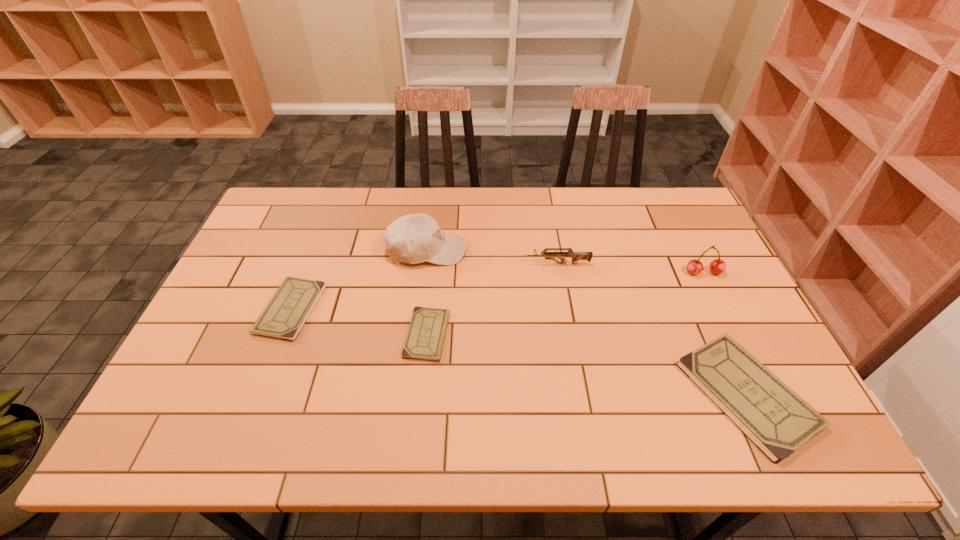
At what (x,y) coordinates should I click in order to perform the action: click on checkbook at the right edge. Please return your answer as a coordinate pair (x, y). The image size is (960, 540). Looking at the image, I should click on (778, 421).

Where is `cherry at the right edge`? This screenshot has width=960, height=540. cherry at the right edge is located at coordinates (717, 266).

Identify the location of object at the near right corner. (778, 421).

Locate an element on the screen. The width and height of the screenshot is (960, 540). vacant space at the far edge of the desktop is located at coordinates (641, 208).

Image resolution: width=960 pixels, height=540 pixels. I want to click on vacant space at the near edge, so click(281, 379).

In the image, there is a desktop. Identify the location of vacant area at the right edge. The height and width of the screenshot is (540, 960). (729, 315).

Locate an element on the screen. free spot between the leftmost object and the cherry is located at coordinates 497,291.

At what (x,y) coordinates should I click in order to perform the action: click on vacant point located between the shortest checkbook and the baseball cap. Please return your answer as a coordinate pair (x, y). This screenshot has height=540, width=960. Looking at the image, I should click on point(427,292).

Where is `vacant point located between the baseball cap and the third shortest object`? Image resolution: width=960 pixels, height=540 pixels. vacant point located between the baseball cap and the third shortest object is located at coordinates [587, 322].

Identify the location of empty space that is in between the baseball cap and the tallest checkbook. The image size is (960, 540). (587, 322).